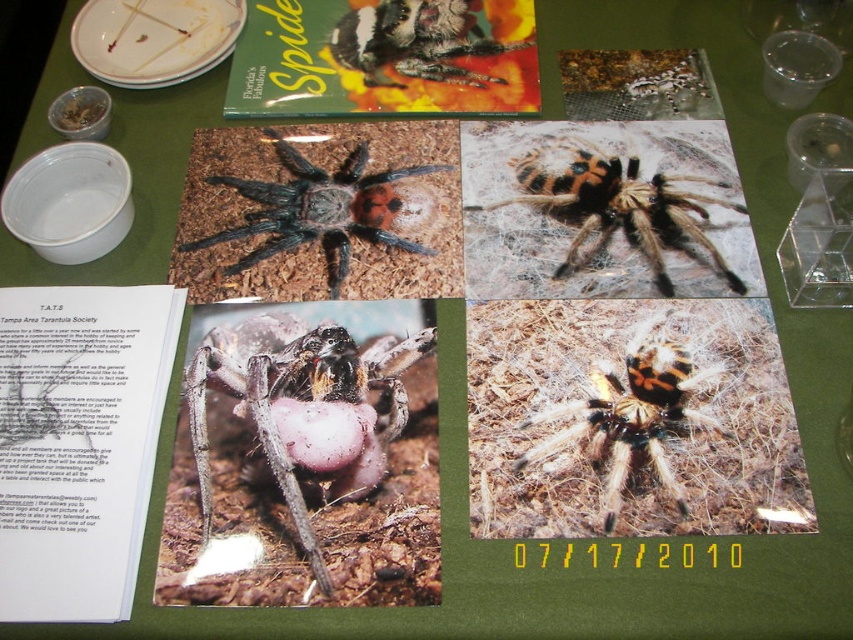
Question: Does white paper at center have a greater width compared to matte gray spider at center?

Choices:
 (A) no
 (B) yes

Answer: (A)

Question: Among these points, which one is nearest to the camera?

Choices:
 (A) (306, 237)
 (B) (637, 348)

Answer: (B)

Question: Which point is closer to the camera taking this photo?

Choices:
 (A) (223, 378)
 (B) (666, 428)
 (C) (65, 296)
 (D) (358, 20)

Answer: (B)

Question: Is white paper at center to the left of matte paper book at upper center from the viewer's perspective?

Choices:
 (A) no
 (B) yes

Answer: (B)

Question: Is black fuzzy spider at center positioned before fluffy orange and black spider at center?

Choices:
 (A) no
 (B) yes

Answer: (A)

Question: Which of the following is the farthest from the observer?

Choices:
 (A) white paper at center
 (B) black fuzzy spider at center

Answer: (B)